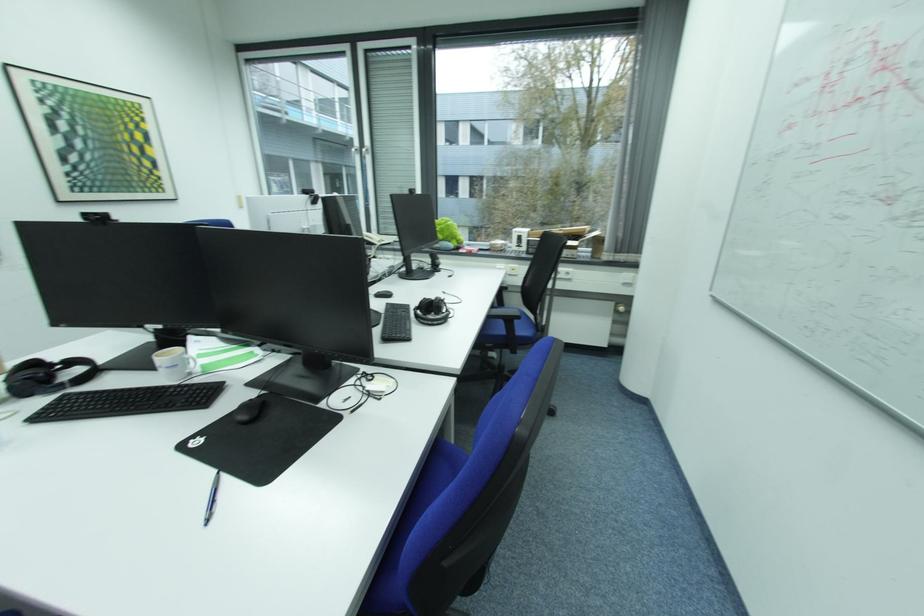
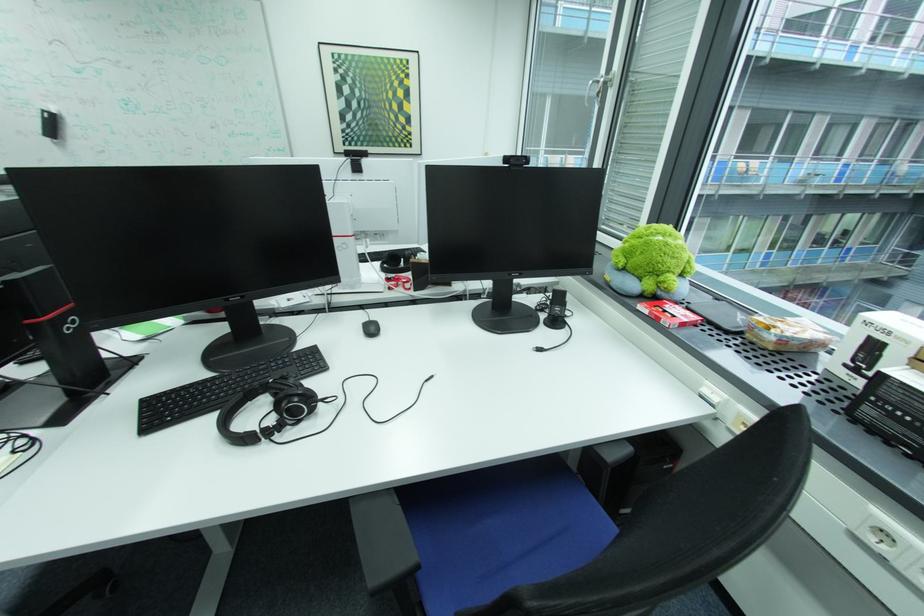
The point at [525,233] is marked in the first image. Where is the corresponding point in the second image?

(876, 323)